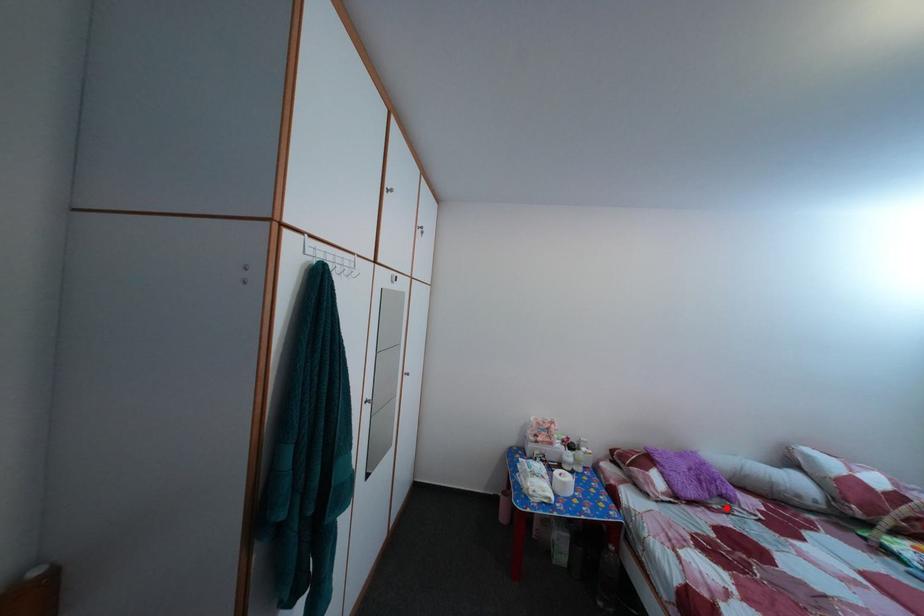
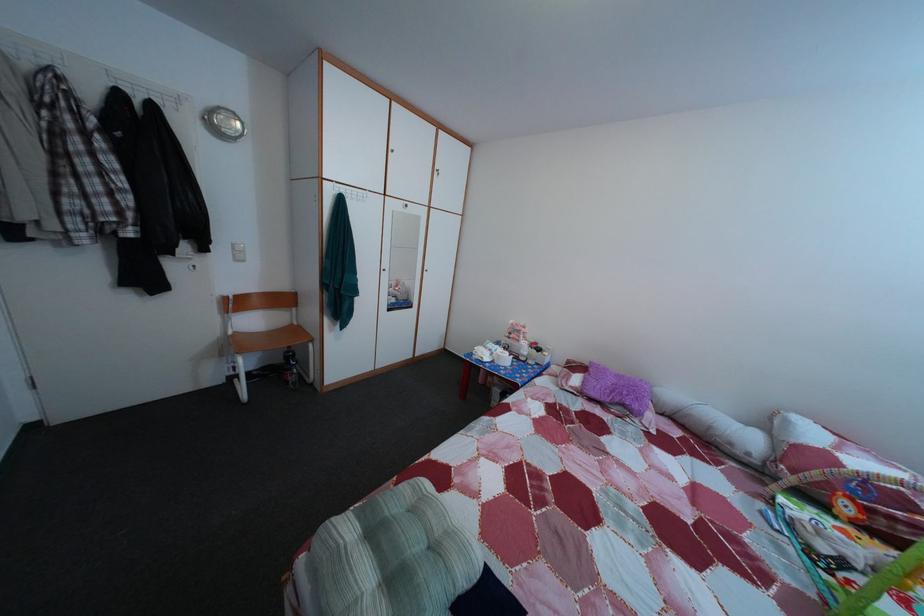
The point at the highlighted location is marked in the first image. Where is the corresponding point in the second image?

(628, 416)